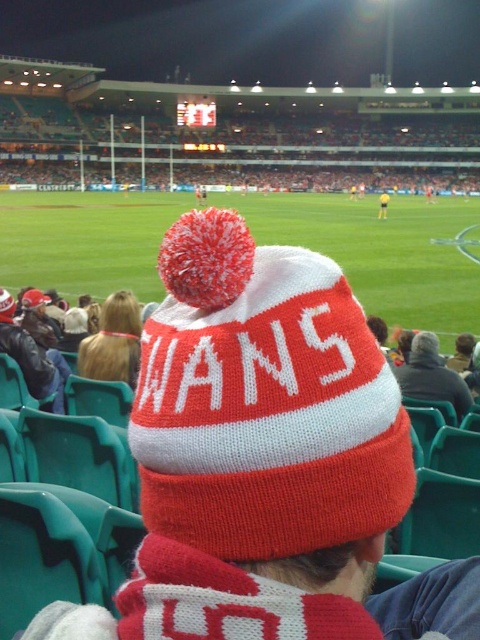
Question: Does green grass football field at center appear over blonde hair at center?

Choices:
 (A) yes
 (B) no

Answer: (A)

Question: Which point is farther to the camera?

Choices:
 (A) green grass football field at center
 (B) knitted woolen hat at center
 (C) dark gray sweater at center
 (D) knitted wool hat at center

Answer: (A)

Question: Estimate the real-world distances between objects in this image. Which object is closer to the yellow jersey at center?

Choices:
 (A) knitted wool hat at center
 (B) green grass football field at center
 (C) knitted woolen hat at center

Answer: (B)

Question: Which point is farther from the camera taking this photo?

Choices:
 (A) (144, 392)
 (B) (384, 193)
 (C) (444, 380)
 (D) (300, 240)

Answer: (B)

Question: Is green grass football field at center positioned in front of dark gray sweater at center?

Choices:
 (A) yes
 (B) no

Answer: (B)

Question: Does blonde hair at center have a greater width compared to yellow jersey at center?

Choices:
 (A) no
 (B) yes

Answer: (A)